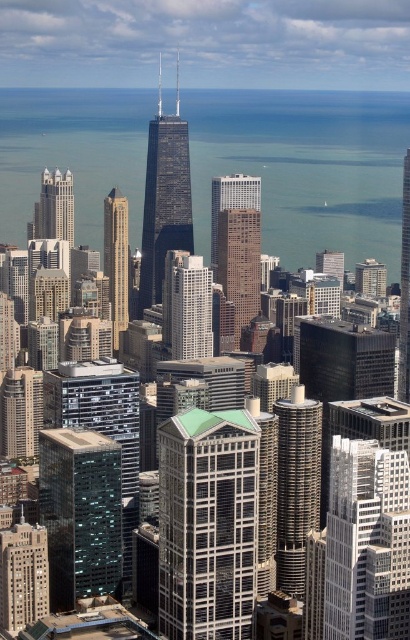
You are a drone operator tasked with flying a drone between the glassy steel skyscraper at center and the matte glass building at lower left. The drone has a maximum flight range of 150 meters. Can you safely fly the drone from one building to the other without exceeding its range?

The distance between the glassy steel skyscraper at center and the matte glass building at lower left is 166.28 meters, which exceeds the drone operator drone has a maximum flight range of 150 meters. Therefore, the drone cannot safely fly between them without exceeding its range.

You are a drone operator flying a drone over the city. Your drone is currently above the blue glass water at center and the black glass skyscraper at center. Which object is closer to your drone?

The blue glass water at center is closer to the drone because it is positioned closer to the viewer than the black glass skyscraper at center.

You are a drone operator trying to navigate between two buildings in the city. You see the green glass building at center and the white glass building at center. Which building is located to the right when facing the city skyline from the ground?

The green glass building at center is positioned on the right side of the white glass building at center, so when facing the city skyline from the ground, the green glass building at center is to the right of the white glass building at center.